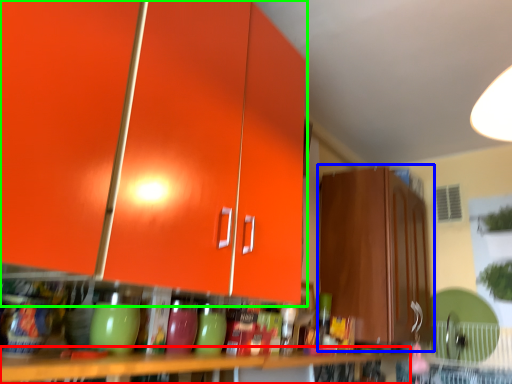
Question: Which object is the closest to the table (highlighted by a red box)? Choose among these: cabinetry (highlighted by a blue box) or cabinetry (highlighted by a green box).

Choices:
 (A) cabinetry
 (B) cabinetry

Answer: (B)